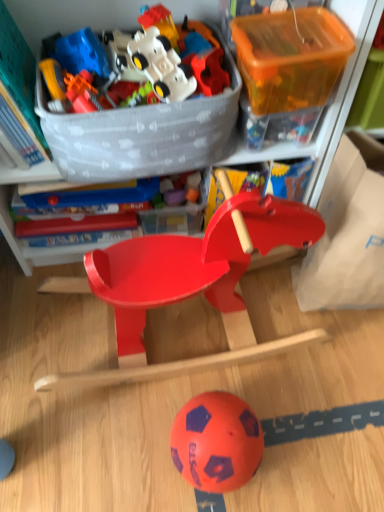
Question: Can you confirm if translucent orange plastic storage box at upper right, which ranks as the 2th storage box in right-to-left order, is shorter than matte plastic rocking horse at center, the 6th toy viewed from the top?

Choices:
 (A) yes
 (B) no

Answer: (A)

Question: From the image's perspective, does translucent orange plastic storage box at upper right, which ranks as the 2th storage box in right-to-left order, appear lower than matte plastic rocking horse at center, the 6th toy viewed from the top?

Choices:
 (A) no
 (B) yes

Answer: (A)

Question: Does translucent orange plastic storage box at upper right, which appears as the 2th storage box when viewed from the left, lie behind matte plastic rocking horse at center, marked as the first toy in a bottom-to-top arrangement?

Choices:
 (A) yes
 (B) no

Answer: (A)

Question: From a real-world perspective, is translucent orange plastic storage box at upper right, which appears as the 2th storage box when viewed from the left, on top of matte plastic rocking horse at center, marked as the first toy in a bottom-to-top arrangement?

Choices:
 (A) yes
 (B) no

Answer: (A)

Question: Is translucent orange plastic storage box at upper right, which appears as the 2th storage box when viewed from the left, aimed at matte plastic rocking horse at center, the 6th toy viewed from the top?

Choices:
 (A) yes
 (B) no

Answer: (B)

Question: Does translucent orange plastic storage box at upper right, which appears as the 2th storage box when viewed from the left, have a greater height compared to matte plastic rocking horse at center, marked as the first toy in a bottom-to-top arrangement?

Choices:
 (A) yes
 (B) no

Answer: (B)

Question: Is the position of matte plastic rocking horse at center more distant than that of rubberized plastic toy at upper center, the 4th toy viewed from the top?

Choices:
 (A) yes
 (B) no

Answer: (B)

Question: Is matte plastic rocking horse at center not close to rubberized plastic toy at upper center, the third toy when ordered from bottom to top?

Choices:
 (A) no
 (B) yes

Answer: (A)

Question: Is matte plastic rocking horse at center beside rubberized plastic toy at upper center, the 4th toy viewed from the top?

Choices:
 (A) yes
 (B) no

Answer: (B)

Question: From the image's perspective, does matte plastic rocking horse at center appear lower than rubberized plastic toy at upper center, the third toy when ordered from bottom to top?

Choices:
 (A) yes
 (B) no

Answer: (A)

Question: Is matte plastic rocking horse at center positioned beyond the bounds of rubberized plastic toy at upper center, the third toy when ordered from bottom to top?

Choices:
 (A) no
 (B) yes

Answer: (B)

Question: Could you tell me if matte plastic rocking horse at center is facing rubberized plastic toy at upper center, the 4th toy viewed from the top?

Choices:
 (A) yes
 (B) no

Answer: (A)

Question: From a real-world perspective, is matte plastic rocking horse at center below matte plastic rocking horse at center, the 6th toy viewed from the top?

Choices:
 (A) no
 (B) yes

Answer: (A)